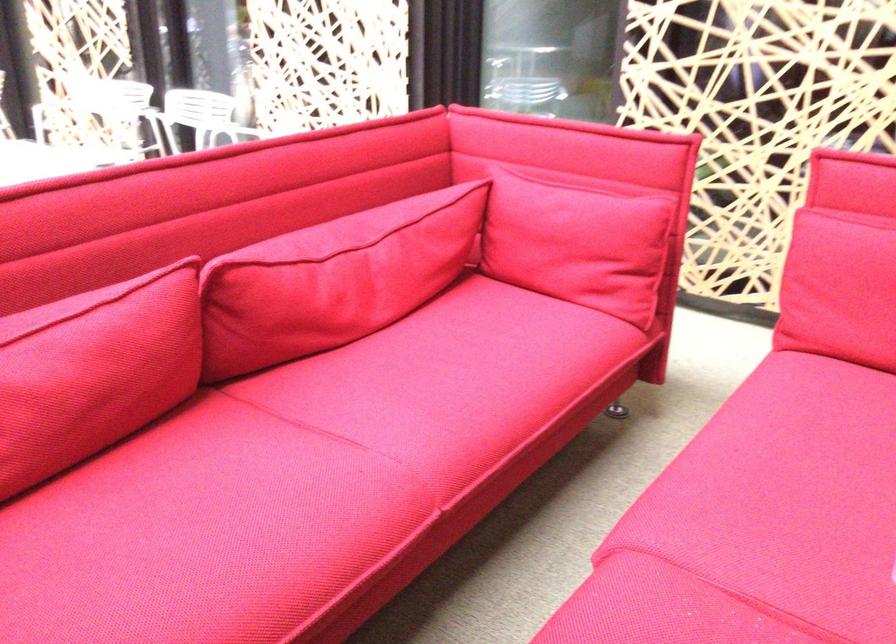
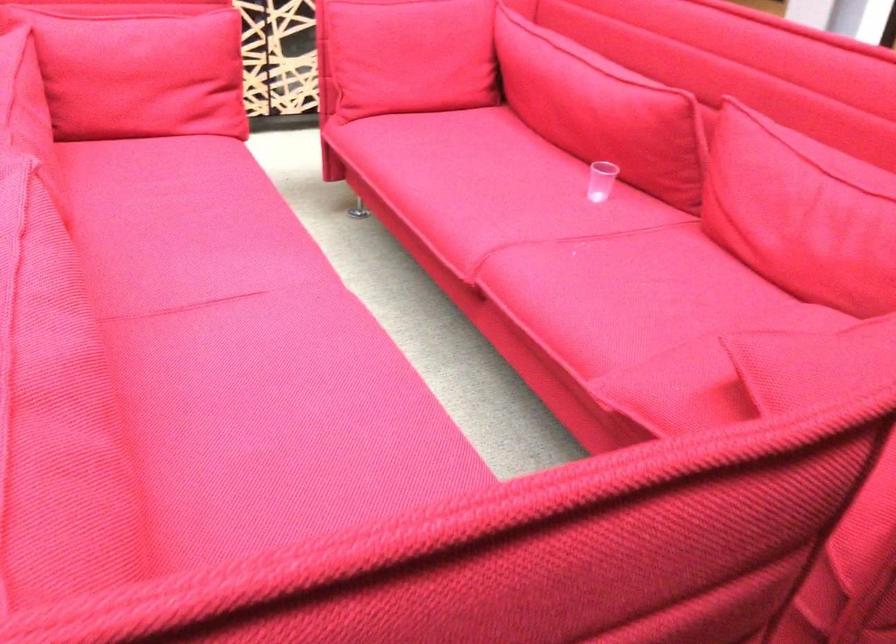
Locate, in the second image, the point that corresponds to point (540, 232) in the first image.

(142, 76)